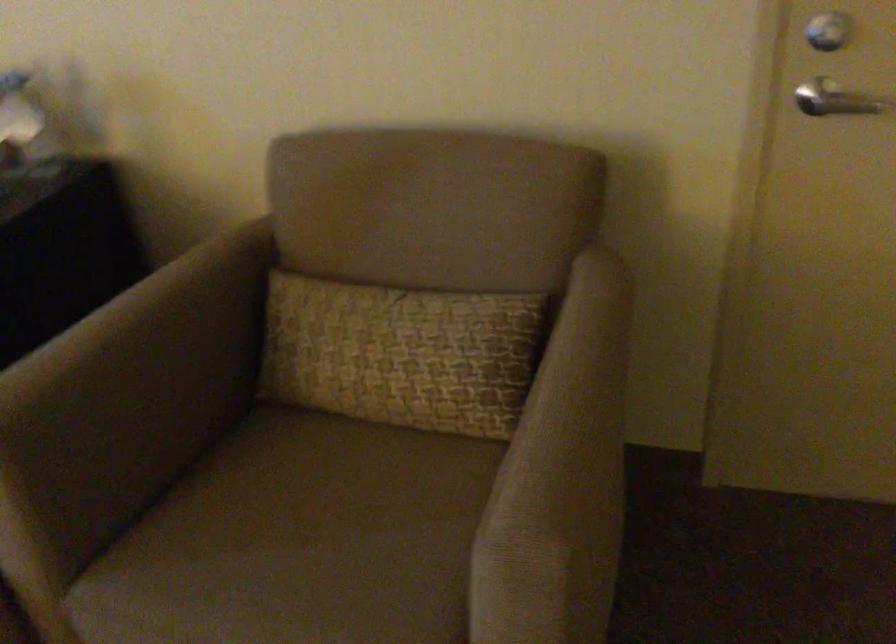
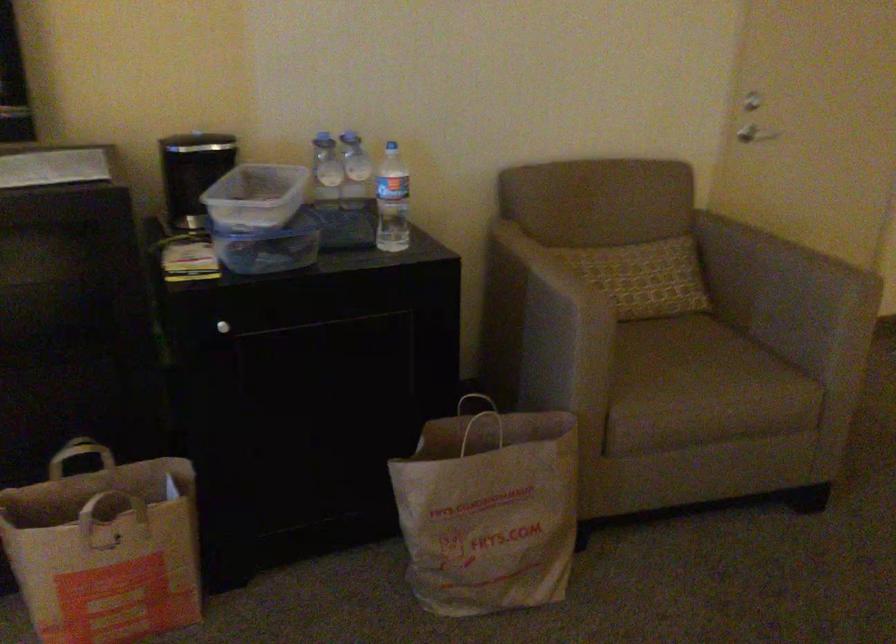
Locate, in the second image, the point that corresponds to (530,401) in the first image.

(767, 259)